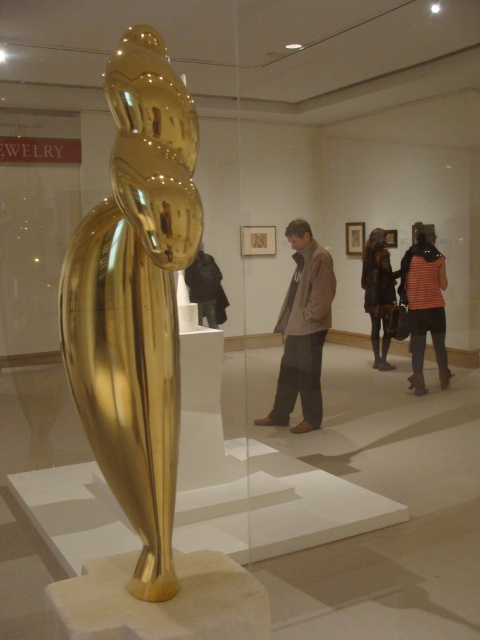
Question: Is brown leather jacket at center thinner than striped fabric at right?

Choices:
 (A) no
 (B) yes

Answer: (A)

Question: Among these objects, which one is nearest to the camera?

Choices:
 (A) brown leather jacket at center
 (B) gold polished sculpture at center
 (C) dark brown leather jacket at center
 (D) striped fabric at right

Answer: (B)

Question: Is the position of gold polished sculpture at center more distant than that of brown leather jacket at center?

Choices:
 (A) no
 (B) yes

Answer: (A)

Question: Which object appears farthest from the camera in this image?

Choices:
 (A) gold polished sculpture at center
 (B) brown leather jacket at center
 (C) striped fabric at right
 (D) dark brown leather jacket at center

Answer: (D)

Question: Among these points, which one is farthest from the camera?

Choices:
 (A) (202, 289)
 (B) (90, 380)
 (C) (282, 371)
 (D) (427, 294)

Answer: (A)

Question: Is brown leather jacket at center closer to camera compared to black fabric jacket at center?

Choices:
 (A) yes
 (B) no

Answer: (A)